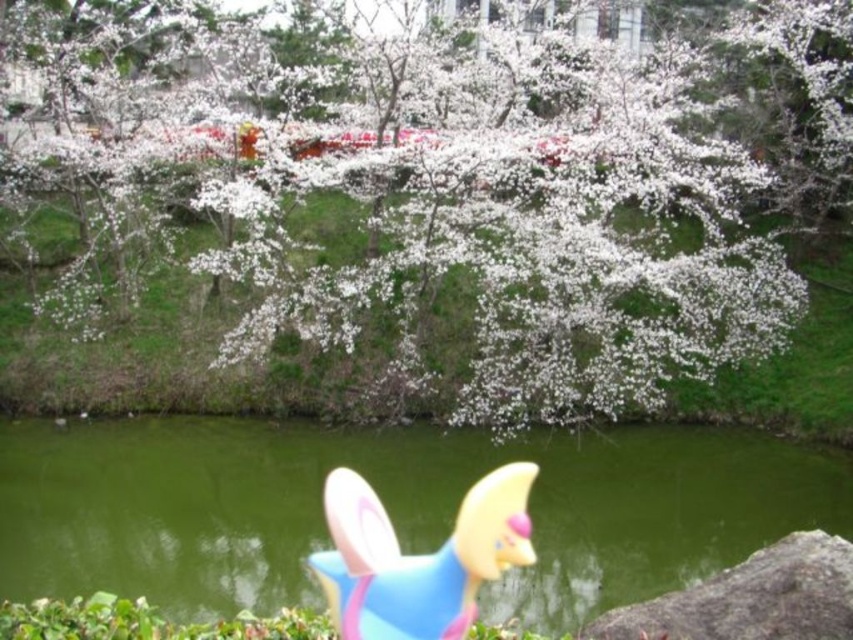
You are standing at the center of the image and want to reach the green glossy water at lower center. Which direction should you move to get there?

The green glossy water at lower center is located at point (390, 508), so you should move downward and to the right to reach it.

You are a child playing near the water and see the blue rubber toy at lower center and the gray rough stone at lower right. Which object is closer to the left side of the image?

The blue rubber toy at lower center is closer to the left side of the image because it is positioned to the left of the gray rough stone at lower right.